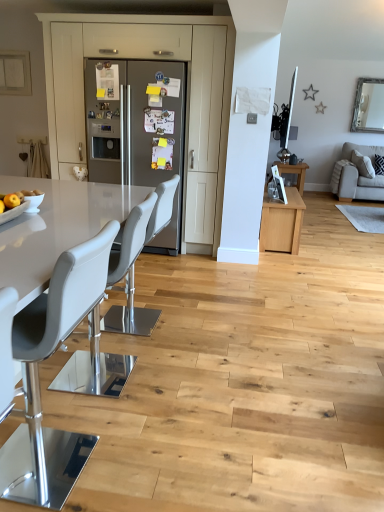
At what (x,y) coordinates should I click in order to perform the action: click on free location in front of gray leather bar stool at center, which is the second chair in back-to-front order. Please return your answer as a coordinate pair (x, y). This screenshot has height=512, width=384. Looking at the image, I should click on tap(105, 416).